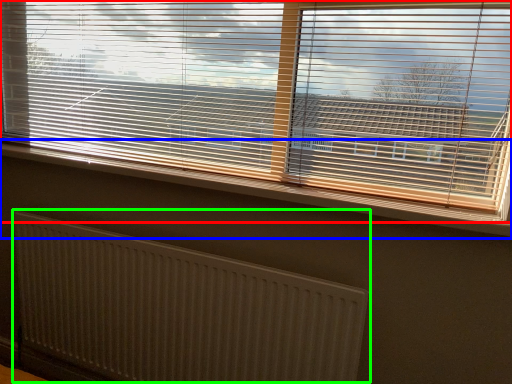
Question: Which object is the closest to the window blind (highlighted by a red box)? Choose among these: window sill (highlighted by a blue box) or radiator (highlighted by a green box).

Choices:
 (A) window sill
 (B) radiator

Answer: (A)